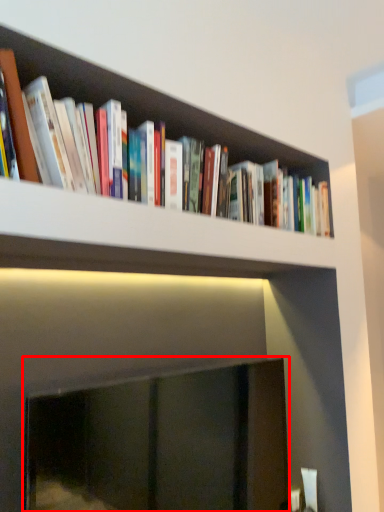
Question: From the image's perspective, what is the correct spatial relationship of fireplace (annotated by the red box) in relation to book?

Choices:
 (A) above
 (B) below

Answer: (B)